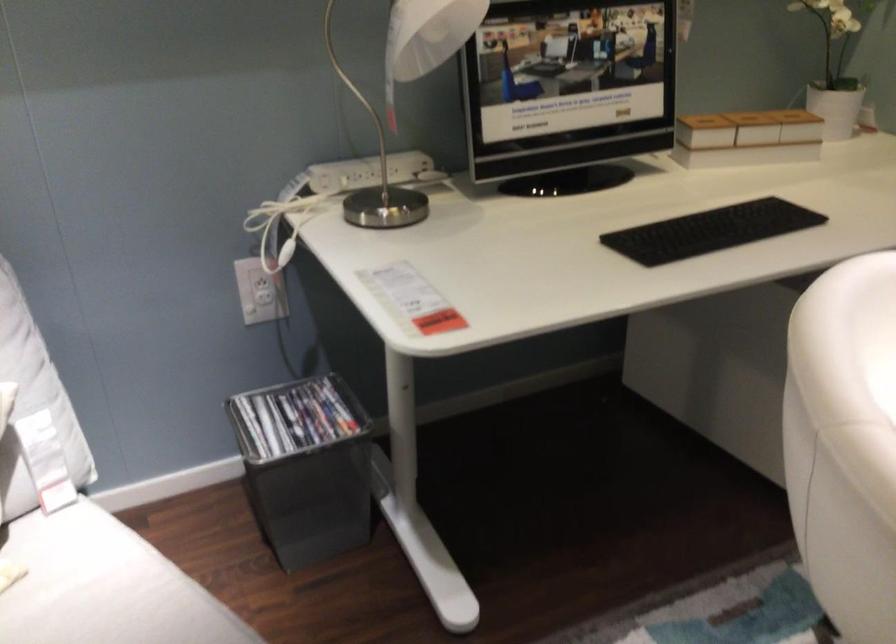
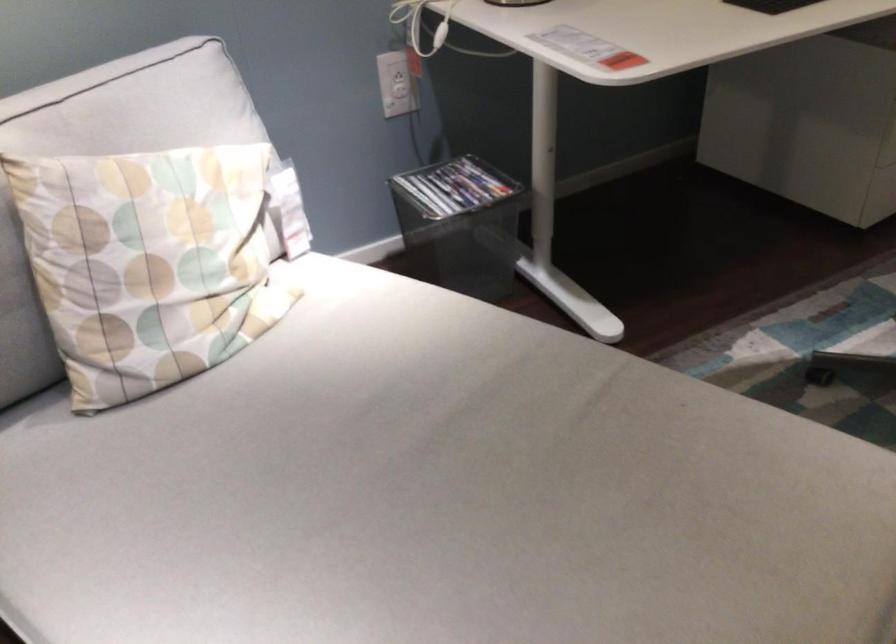
In the second image, find the point that corresponds to [321,412] in the first image.

(454, 187)